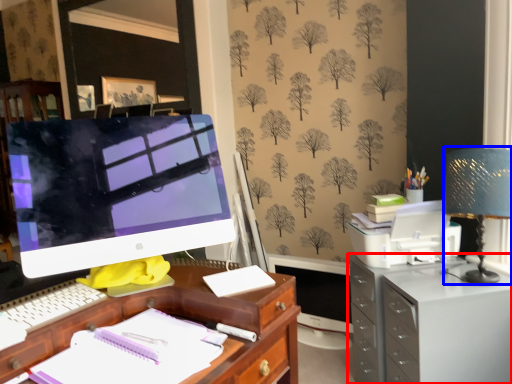
Question: Among these objects, which one is farthest to the camera, filing cabinet (highlighted by a red box) or table lamp (highlighted by a blue box)?

Choices:
 (A) filing cabinet
 (B) table lamp

Answer: (A)